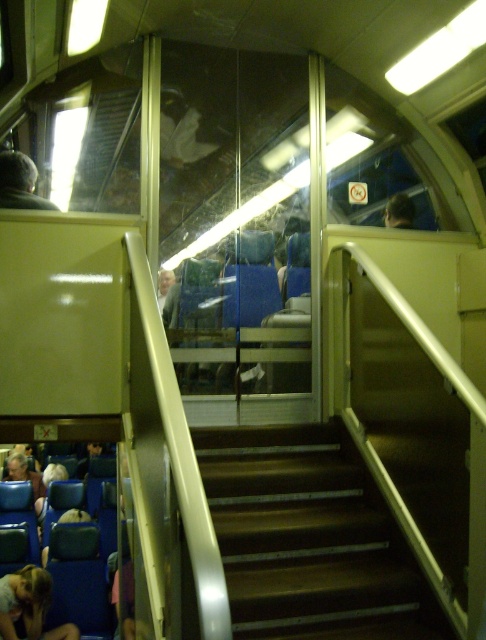
You are standing at the bottom of the metallic brown stairs at center and want to reach the light brown fabric person at lower left. Which direction should you move to get closer to them?

The metallic brown stairs at center is positioned on the right side of the light brown fabric person at lower left, so you should move to the left to get closer to them.

You are standing at the bottom of the staircase in the train carriage and see the light brown fabric person at lower left and the light brown hair at upper center. Which one is closer to you?

The light brown fabric person at lower left is closer to you because they are in front of the light brown hair at upper center.